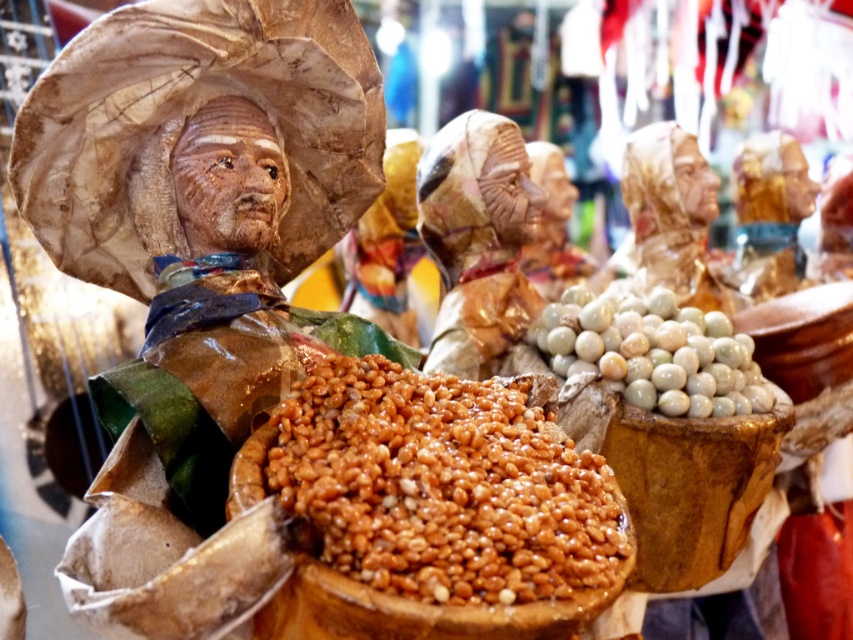
Question: Is brown glossy grain at center to the right of white marble beads at center from the viewer's perspective?

Choices:
 (A) yes
 (B) no

Answer: (B)

Question: Which point is closer to the camera?

Choices:
 (A) (685, 413)
 (B) (465, 232)
 (C) (114, 166)
 (D) (328, 422)

Answer: (D)

Question: Is matte clay figure at center further to camera compared to brown glossy grain at center?

Choices:
 (A) no
 (B) yes

Answer: (B)

Question: Among these objects, which one is nearest to the camera?

Choices:
 (A) brown glossy grain at center
 (B) white marble beads at center
 (C) matte clay figure at center

Answer: (A)

Question: Estimate the real-world distances between objects in this image. Which object is farther from the matte brown statue at center?

Choices:
 (A) brown glossy grain at center
 (B) matte clay figure at center

Answer: (A)

Question: Is matte clay figure at center positioned behind white marble beads at center?

Choices:
 (A) yes
 (B) no

Answer: (B)